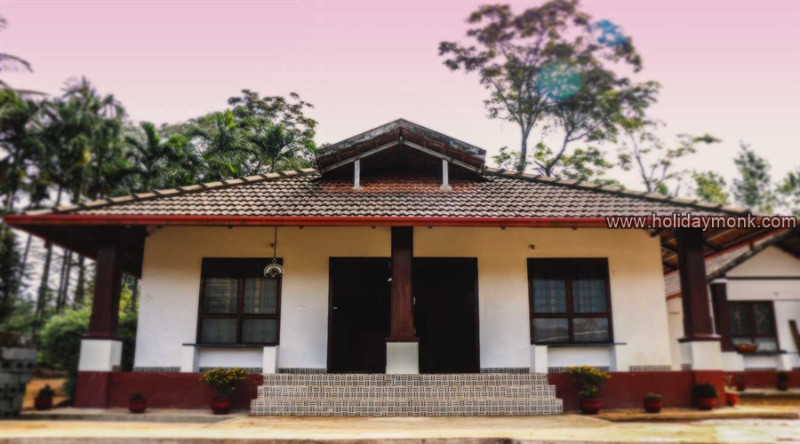
Locate an element on the screen. windows is located at coordinates (560, 309), (257, 310), (228, 298), (586, 304), (762, 314), (742, 316).